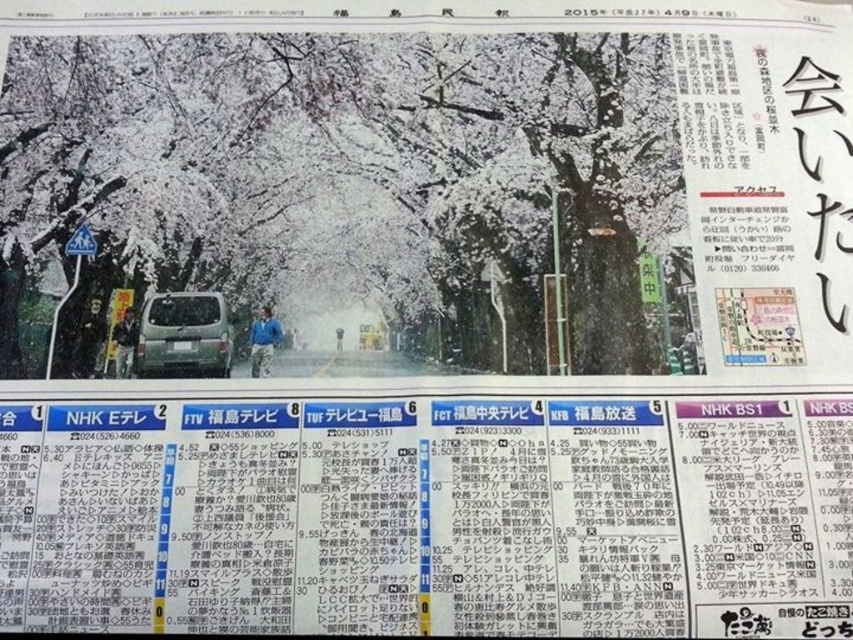
You are a delivery person who needs to deliver a package to the address written on the white paper at bottom. The matte silver van at center is your vehicle. Can you see the address clearly from where you are standing next to the van?

The white paper at bottom is in front of matte silver van at center, so you cannot see the address clearly from where you are standing next to the van because the paper is blocking your view.

You are a delivery person who needs to place a package on the white paper at bottom and the matte silver van at center. Since you have limited space, which object can accommodate a larger package?

The white paper at bottom has a larger size compared to the matte silver van at center, so it can accommodate a larger package.